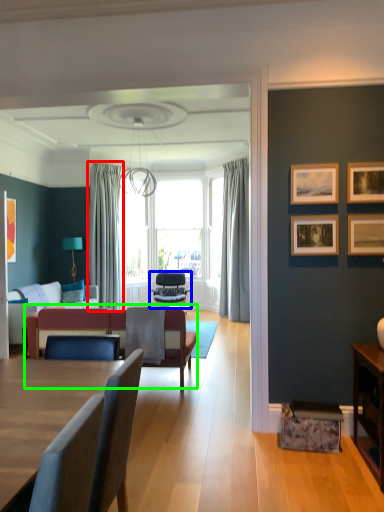
Question: Which is farther away from curtain (highlighted by a red box)? chair (highlighted by a blue box) or couch (highlighted by a green box)?

Choices:
 (A) chair
 (B) couch

Answer: (B)